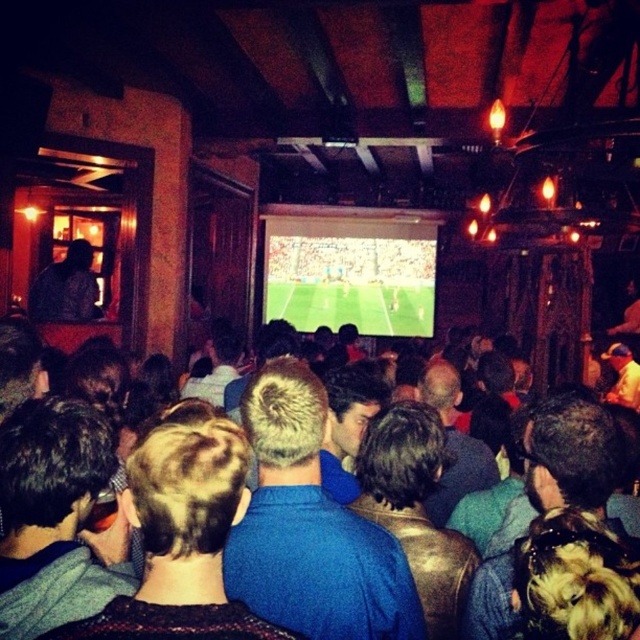
Which is in front, point (312, 499) or point (483, 488)?

Point (312, 499) is in front.

Between blue cotton shirt at center and dark blue shirt at center, which one appears on the left side from the viewer's perspective?

From the viewer's perspective, blue cotton shirt at center appears more on the left side.

Locate an element on the screen. The width and height of the screenshot is (640, 640). blue cotton shirt at center is located at coordinates (310, 528).

Does dark brown hair at center have a larger size compared to white glossy screen at center?

Actually, dark brown hair at center might be smaller than white glossy screen at center.

Between point (122, 556) and point (420, 291), which one is positioned in front?

Point (122, 556)

Where is `dark brown hair at center`? The height and width of the screenshot is (640, 640). dark brown hair at center is located at coordinates tap(52, 516).

Which is in front, point (326, 260) or point (538, 492)?

Positioned in front is point (538, 492).

Does white glossy screen at center have a greater width compared to dark brown leather jacket at center?

Yes.

Does point (320, 268) lie in front of point (548, 464)?

No, (320, 268) is further to viewer.

You are a GUI agent. You are given a task and a screenshot of the screen. Output one action in this format:
    pyautogui.click(x=<x>, y=<y>)
    Task: Click on the white glossy screen at center
    
    Given the screenshot: What is the action you would take?
    pyautogui.click(x=349, y=273)